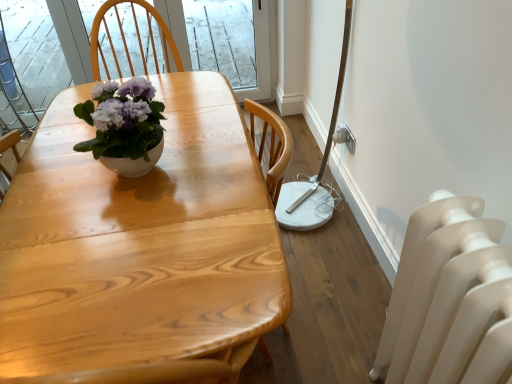
Question: Is white matte radiator at lower right wider than natural wood table at center?

Choices:
 (A) yes
 (B) no

Answer: (B)

Question: Is white matte radiator at lower right placed right next to natural wood table at center?

Choices:
 (A) yes
 (B) no

Answer: (B)

Question: Is white matte radiator at lower right to the left of natural wood table at center from the viewer's perspective?

Choices:
 (A) no
 (B) yes

Answer: (A)

Question: Is white matte radiator at lower right not within natural wood table at center?

Choices:
 (A) yes
 (B) no

Answer: (A)

Question: From the image's perspective, would you say white matte radiator at lower right is shown under natural wood table at center?

Choices:
 (A) no
 (B) yes

Answer: (B)

Question: Is point (402, 352) closer or farther from the camera than point (241, 244)?

Choices:
 (A) closer
 (B) farther

Answer: (B)

Question: From a real-world perspective, is white matte radiator at lower right above or below natural wood table at center?

Choices:
 (A) above
 (B) below

Answer: (B)

Question: In terms of width, does white matte radiator at lower right look wider or thinner when compared to natural wood table at center?

Choices:
 (A) thin
 (B) wide

Answer: (A)

Question: Based on their sizes in the image, would you say white matte radiator at lower right is bigger or smaller than natural wood table at center?

Choices:
 (A) small
 (B) big

Answer: (A)

Question: From a real-world perspective, is white glossy pot at center above or below natural wood table at center?

Choices:
 (A) above
 (B) below

Answer: (A)

Question: Looking at their shapes, would you say white glossy pot at center is wider or thinner than natural wood table at center?

Choices:
 (A) wide
 (B) thin

Answer: (B)

Question: Looking at the image, does white glossy pot at center seem bigger or smaller compared to natural wood table at center?

Choices:
 (A) small
 (B) big

Answer: (A)

Question: Is white glossy pot at center taller or shorter than natural wood table at center?

Choices:
 (A) tall
 (B) short

Answer: (B)

Question: From the image's perspective, is natural wood table at center above or below white glossy pot at center?

Choices:
 (A) above
 (B) below

Answer: (B)

Question: Would you say natural wood table at center is to the left or to the right of white glossy pot at center in the picture?

Choices:
 (A) left
 (B) right

Answer: (B)